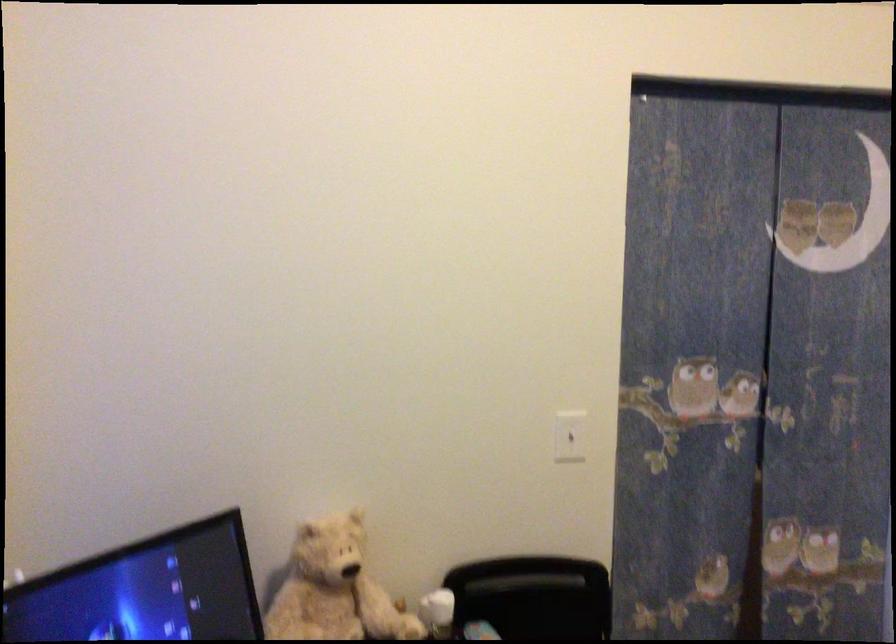
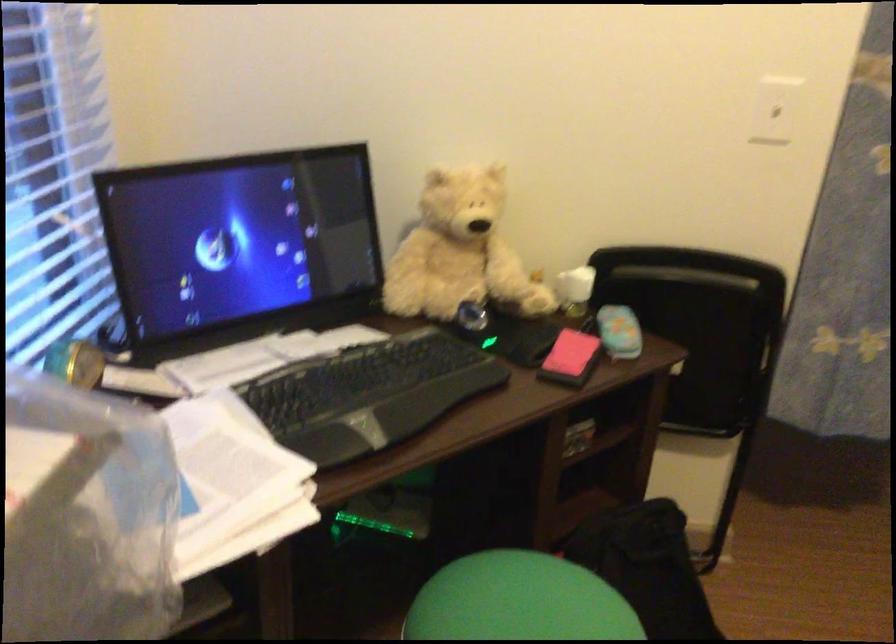
Looking at this image, in a continuous first-person perspective shot, in which direction is the camera moving?

The cameraman moved toward right, forward.